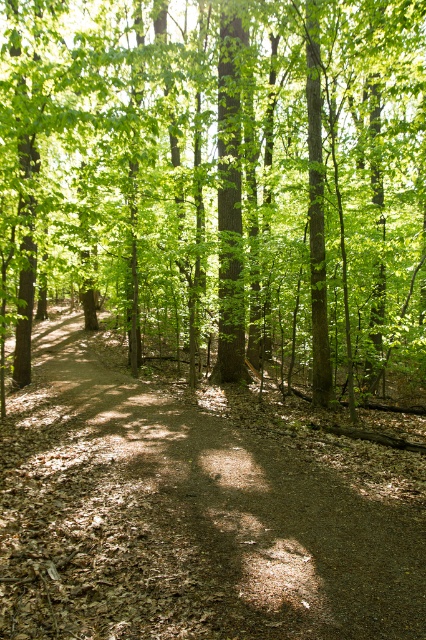
Question: Is green leafy tree at center closer to camera compared to dirt path at center?

Choices:
 (A) no
 (B) yes

Answer: (A)

Question: Which object appears closest to the camera in this image?

Choices:
 (A) green leafy tree at center
 (B) dirt path at center

Answer: (B)

Question: Can you confirm if green leafy tree at center is positioned below dirt path at center?

Choices:
 (A) yes
 (B) no

Answer: (B)

Question: Does green leafy tree at center have a greater width compared to dirt path at center?

Choices:
 (A) yes
 (B) no

Answer: (A)

Question: Among these points, which one is nearest to the camera?

Choices:
 (A) (408, 588)
 (B) (20, 92)

Answer: (A)